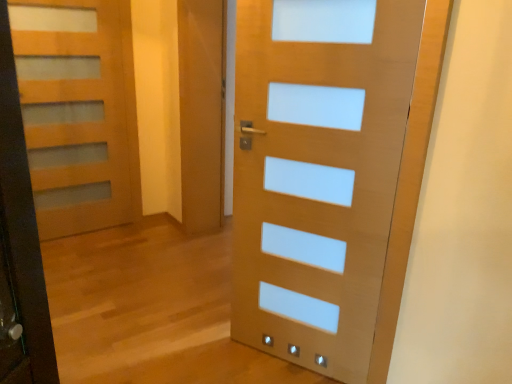
Question: Looking at their shapes, would you say matte wood door at left, marked as the second door in a front-to-back arrangement, is wider or thinner than matte wood door at center, marked as the first door in a front-to-back arrangement?

Choices:
 (A) thin
 (B) wide

Answer: (A)

Question: Considering the relative positions of matte wood door at left, the second door viewed from the right, and matte wood door at center, arranged as the 1th door when viewed from the right, in the image provided, is matte wood door at left, the second door viewed from the right, to the left or to the right of matte wood door at center, arranged as the 1th door when viewed from the right,?

Choices:
 (A) right
 (B) left

Answer: (B)

Question: From their relative heights in the image, would you say matte wood door at left, marked as the second door in a front-to-back arrangement, is taller or shorter than matte wood door at center, the second door viewed from the left?

Choices:
 (A) tall
 (B) short

Answer: (A)

Question: In terms of size, does matte wood door at center, acting as the second door starting from the back, appear bigger or smaller than matte wood door at left, which appears as the 1th door when viewed from the back?

Choices:
 (A) big
 (B) small

Answer: (A)

Question: From a real-world perspective, is matte wood door at center, marked as the first door in a front-to-back arrangement, positioned above or below matte wood door at left, the second door viewed from the right?

Choices:
 (A) below
 (B) above

Answer: (A)

Question: Looking at their shapes, would you say matte wood door at center, arranged as the 1th door when viewed from the right, is wider or thinner than matte wood door at left, which appears as the 1th door when viewed from the back?

Choices:
 (A) thin
 (B) wide

Answer: (B)

Question: Is matte wood door at center, marked as the first door in a front-to-back arrangement, in front of or behind matte wood door at left, which appears as the 1th door when viewed from the back, in the image?

Choices:
 (A) front
 (B) behind

Answer: (A)